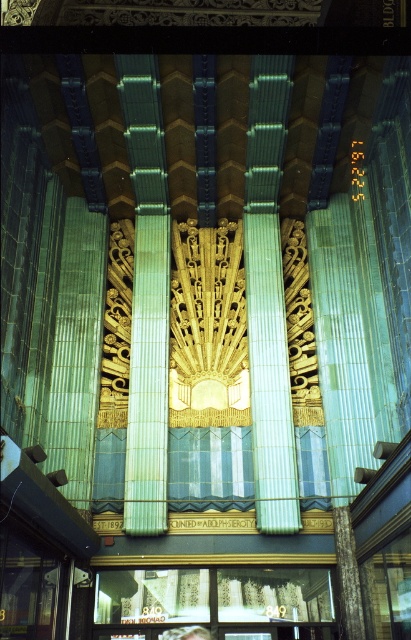
You are standing at the entrance of the building and want to touch both the white textured curtains at lower center and the light brown hair at lower center. Given that you can only move forward or backward, which object will you reach first?

The light brown hair at lower center will be reached first because it is closer to you than the white textured curtains at lower center, which are 14.34 feet away.